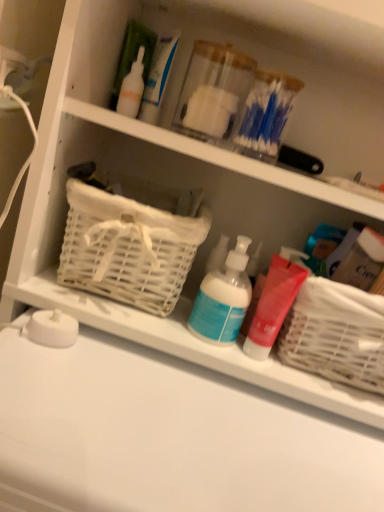
Locate an element on the screen. vacant space in front of white woven basket at right, arranged as the first basket when viewed from the right is located at coordinates (299, 447).